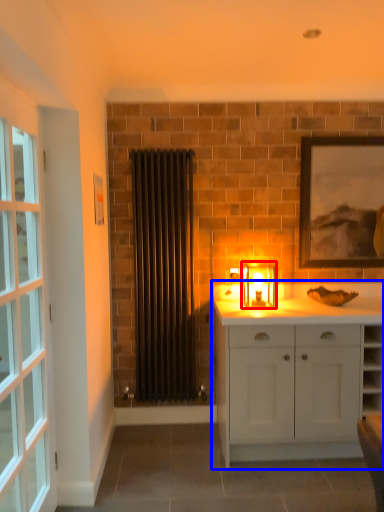
Question: Which object appears farthest to the camera in this image, candle holder (highlighted by a red box) or cabinetry (highlighted by a blue box)?

Choices:
 (A) candle holder
 (B) cabinetry

Answer: (A)